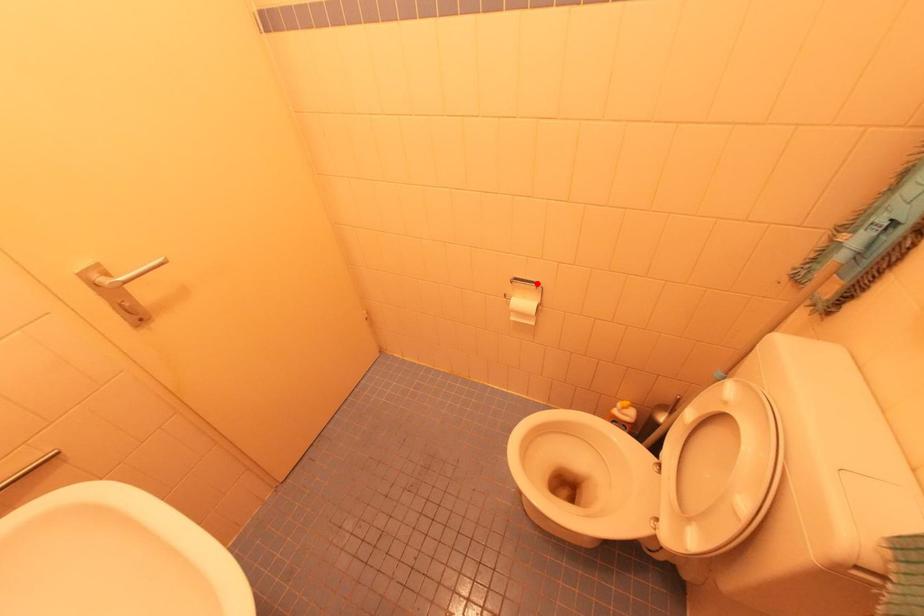
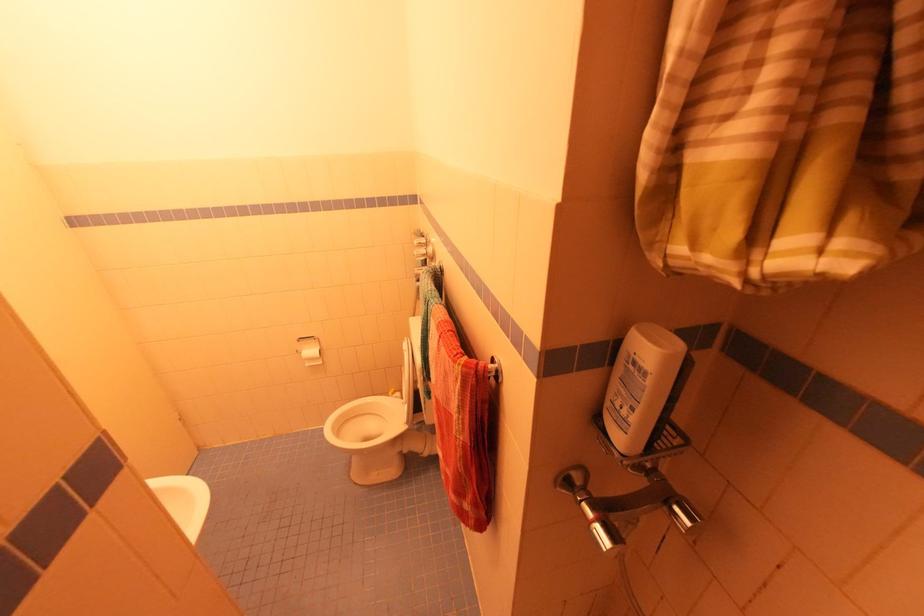
Find the pixel in the second image that matches the highlighted location in the first image.

(314, 338)